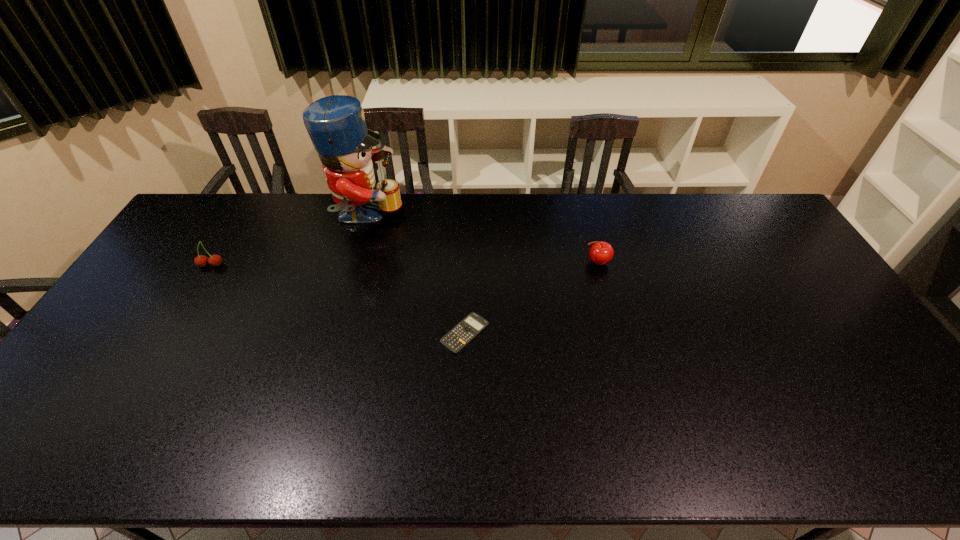
The image size is (960, 540). Find the location of `the third object from right to left`. the third object from right to left is located at coordinates (336, 124).

The image size is (960, 540). I want to click on the tallest object, so click(x=336, y=124).

Find the location of a particular element. The image size is (960, 540). the leftmost object is located at coordinates (215, 260).

The image size is (960, 540). Identify the location of the right cherry. (601, 253).

Locate an element on the screen. This screenshot has width=960, height=540. calculator is located at coordinates (457, 338).

Locate an element on the screen. The height and width of the screenshot is (540, 960). the nearest object is located at coordinates (457, 338).

This screenshot has width=960, height=540. What are the coordinates of `vacant space located on the front-facing side of the second object from left to right` in the screenshot? It's located at (452, 218).

You are a GUI agent. You are given a task and a screenshot of the screen. Output one action in this format:
    pyautogui.click(x=<x>, y=<y>)
    Task: Click on the vacant space situated 0.400m on the surface of the left cherry
    The width and height of the screenshot is (960, 540).
    Given the screenshot: What is the action you would take?
    pyautogui.click(x=142, y=380)

Identify the location of vacant region located 0.250m on the right of the rightmost object. (687, 262).

The image size is (960, 540). What are the coordinates of `free spot located on the back of the second object from right to left` in the screenshot? It's located at (467, 269).